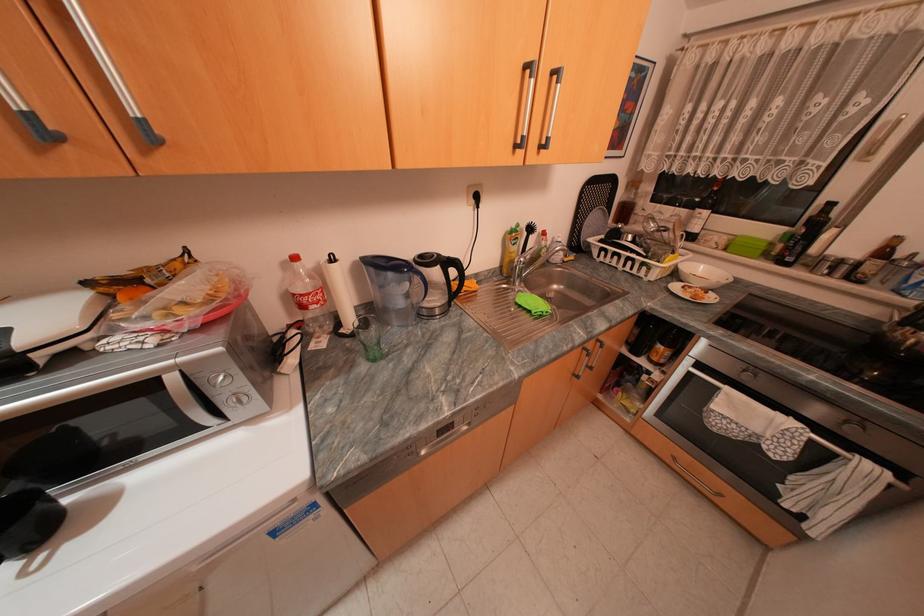
Find where to lift the electric kettle handle. Please return your answer as a coordinate pair (x, y).

(456, 276)